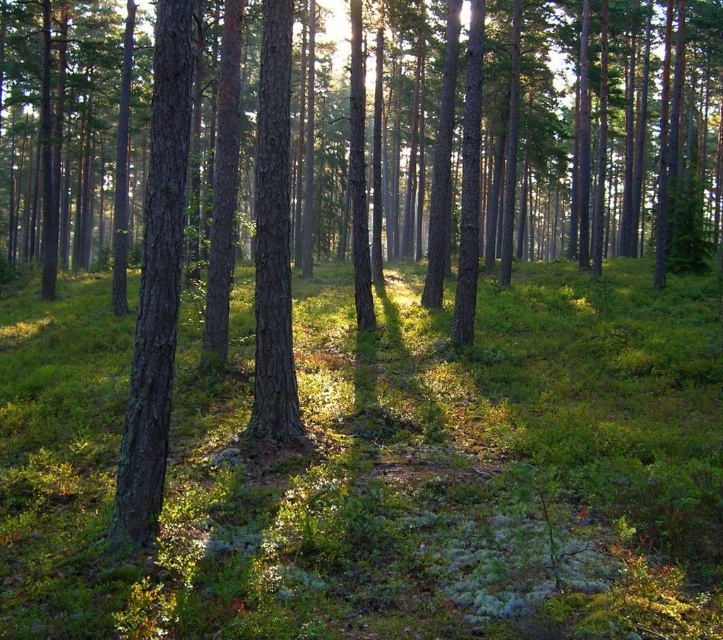
Question: Which point is farther to the camera?

Choices:
 (A) (154, 49)
 (B) (290, 404)

Answer: (B)

Question: Does smooth brown tree trunk at left have a smaller size compared to smooth bark tree at center?

Choices:
 (A) no
 (B) yes

Answer: (B)

Question: Does smooth brown tree trunk at left appear over smooth bark tree at center?

Choices:
 (A) yes
 (B) no

Answer: (B)

Question: Which object is farther from the camera taking this photo?

Choices:
 (A) smooth bark tree at center
 (B) smooth brown tree trunk at left

Answer: (A)

Question: Can you confirm if smooth brown tree trunk at left is bigger than smooth bark tree at center?

Choices:
 (A) no
 (B) yes

Answer: (A)

Question: Which point is closer to the camera?

Choices:
 (A) smooth brown tree trunk at left
 (B) smooth bark tree at center

Answer: (A)